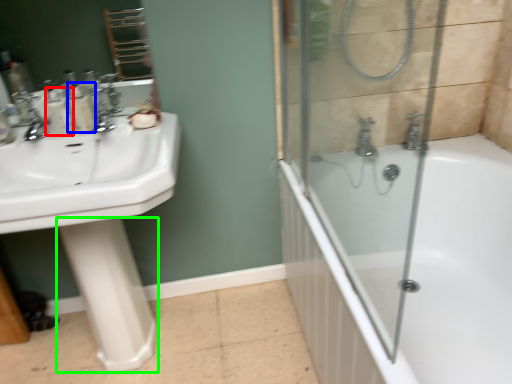
Question: Considering the real-world distances, which object is farthest from toiletry (highlighted by a red box)? toiletry (highlighted by a blue box) or bidet (highlighted by a green box)?

Choices:
 (A) toiletry
 (B) bidet

Answer: (B)